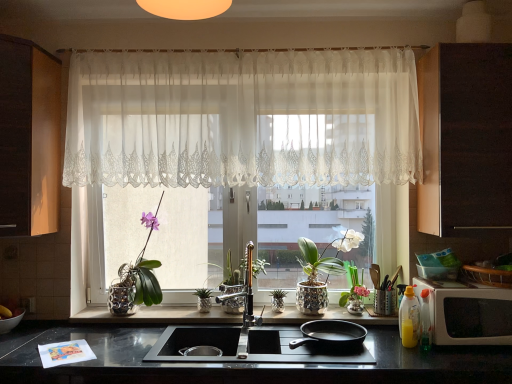
Find the location of a particular element. This screenshot has width=512, height=384. blank space to the left of translucent plastic bottle at lower right is located at coordinates (397, 353).